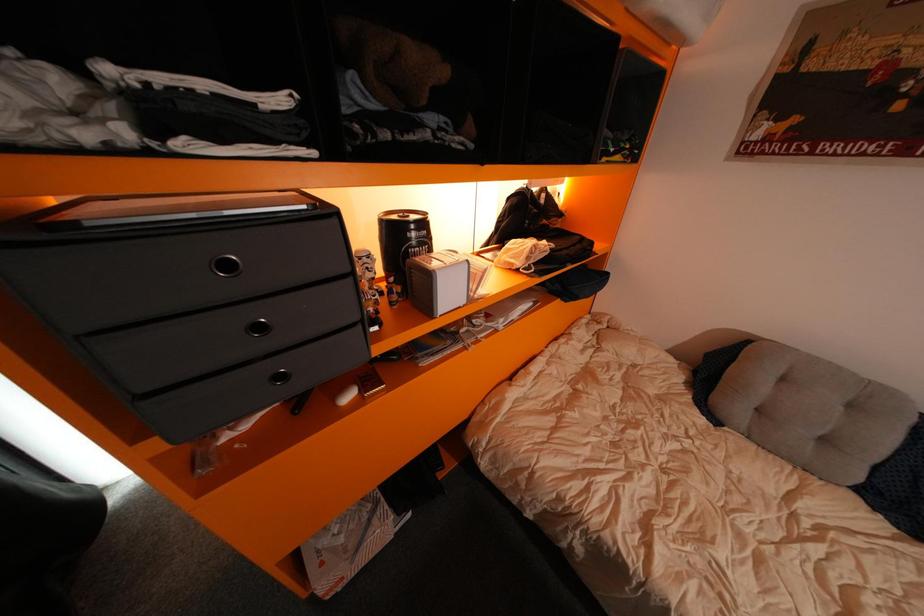
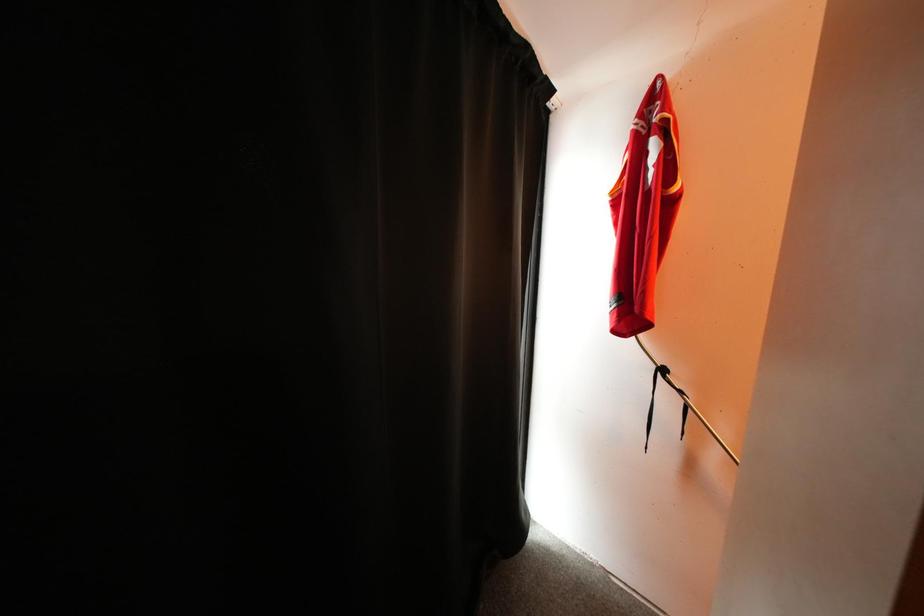
Question: How did the camera likely rotate?

Choices:
 (A) Left
 (B) Right
 (C) Up
 (D) Down

Answer: (A)